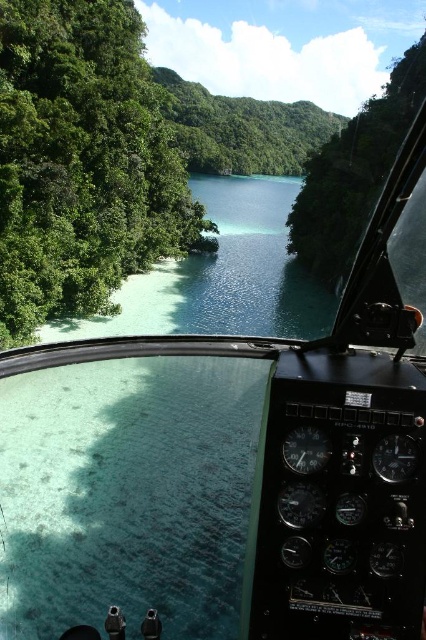
You are a pilot flying a helicopter and you see the green leafy trees at left and the green leafy vegetation at center through the cockpit window. Which of these two objects is positioned lower in your field of view?

The green leafy trees at left is located below green leafy vegetation at center, so the green leafy trees at left is positioned lower in your field of view.

You are a pilot flying a helicopter and looking out the cockpit window. You notice the green leafy trees at left and the green leafy vegetation at center in the view. Which of these two objects appears taller from your current perspective?

The green leafy trees at left appears taller than the green leafy vegetation at center from the pilot perspective.